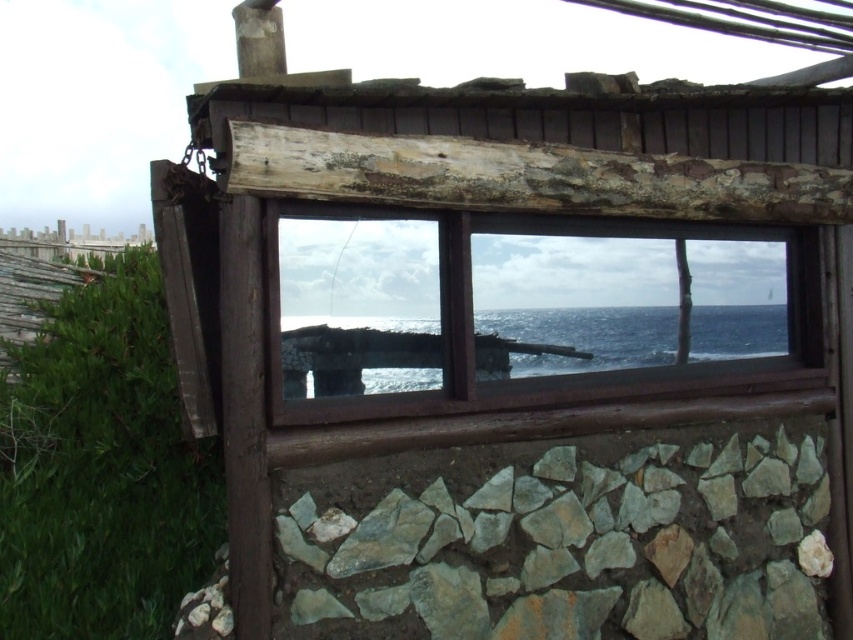
Question: Which of the following is the farthest from the observer?

Choices:
 (A) (485, 561)
 (B) (329, 355)
 (C) (500, 381)

Answer: (C)

Question: Is brown wooden window frame at center above blue water at center?

Choices:
 (A) yes
 (B) no

Answer: (A)

Question: Can you confirm if brown wooden window frame at center is thinner than blue water at center?

Choices:
 (A) no
 (B) yes

Answer: (A)

Question: Does gray rough stone at lower center appear under blue water at center?

Choices:
 (A) yes
 (B) no

Answer: (A)

Question: Estimate the real-world distances between objects in this image. Which object is farther from the brown wooden window frame at center?

Choices:
 (A) blue water at center
 (B) gray rough stone at lower center

Answer: (B)

Question: Which point appears closest to the camera in this image?

Choices:
 (A) (601, 484)
 (B) (728, 324)
 (C) (436, 321)

Answer: (C)